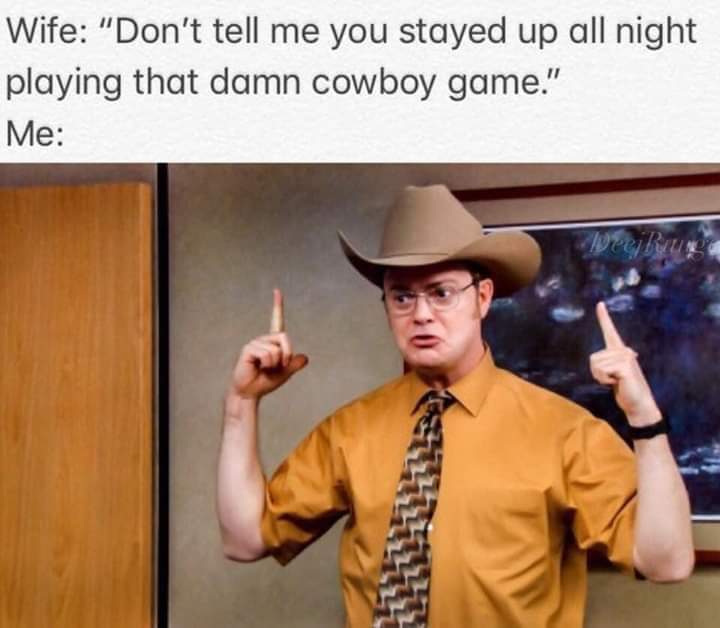
I want to click on picture in frame, so click(x=660, y=330).